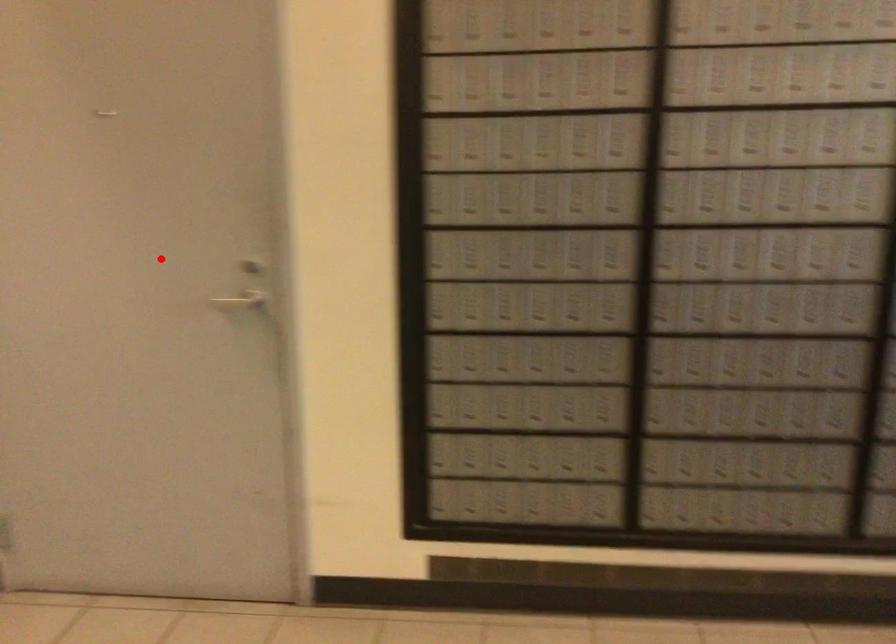
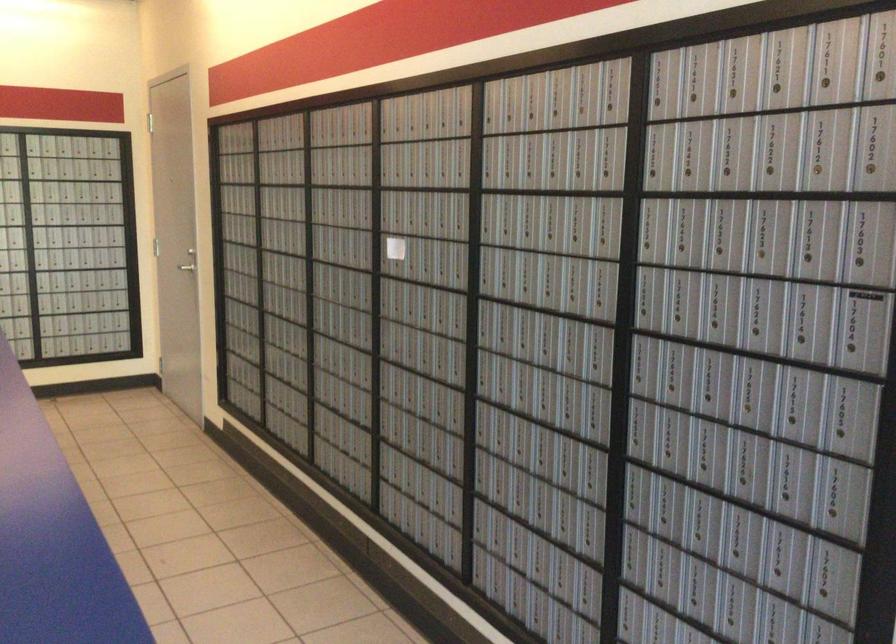
The point at the highlighted location is marked in the first image. Where is the corresponding point in the second image?

(176, 241)